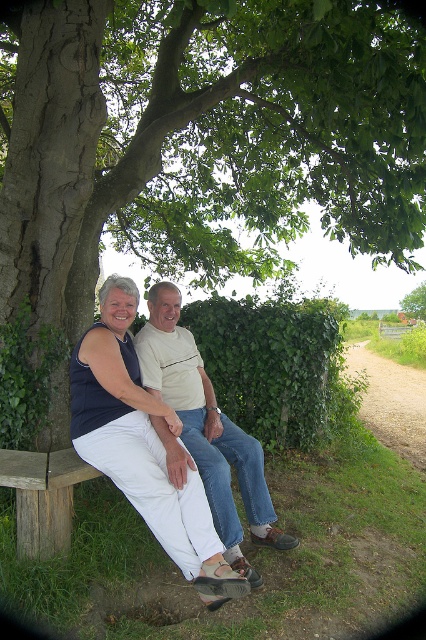
You are planning to place a small birdhouse on the green leafy tree at left. Given that the brown wooden bench at lower left is 1.5 meters wide, can the birdhouse fit on the tree?

The green leafy tree at left is smaller than the brown wooden bench at lower left, which is 1.5 meters wide. Since the tree is smaller, it may not have enough space to accommodate the birdhouse.

You are a photographer trying to capture a photo of the green leafy hedge at center and the light beige cotton shirt at center. Which object should you focus on first if you want to ensure both are in focus, considering their sizes?

The green leafy hedge at center is bigger than the light beige cotton shirt at center, so focusing on the larger object first would help ensure both are in focus.